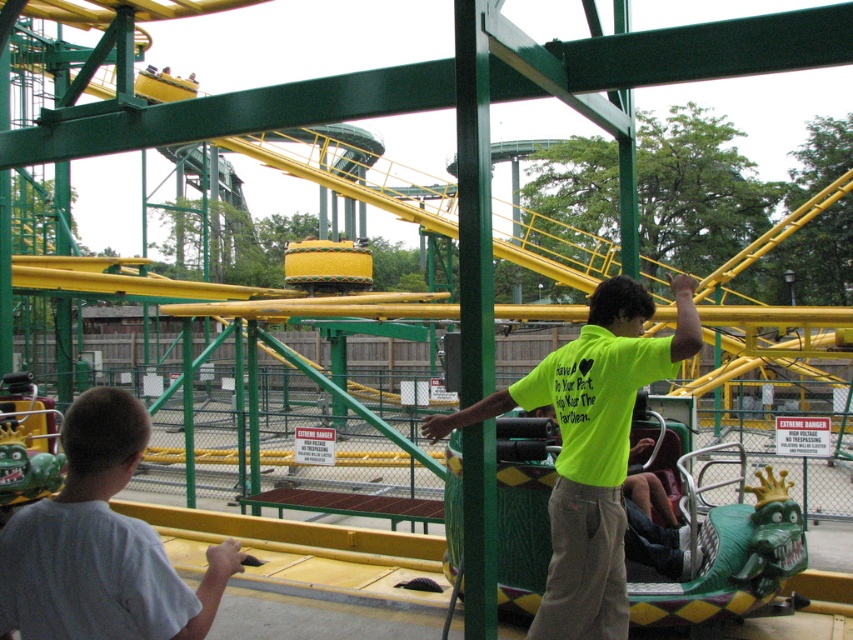
You are standing at the roller coaster entrance and see two points marked on the ground. The first point is at coordinate point (698, 348) and the second is at point (103, 490). Which point is closer to you?

Point (103, 490) is closer to you because according to the description, point (698, 348) is behind point (103, 490).